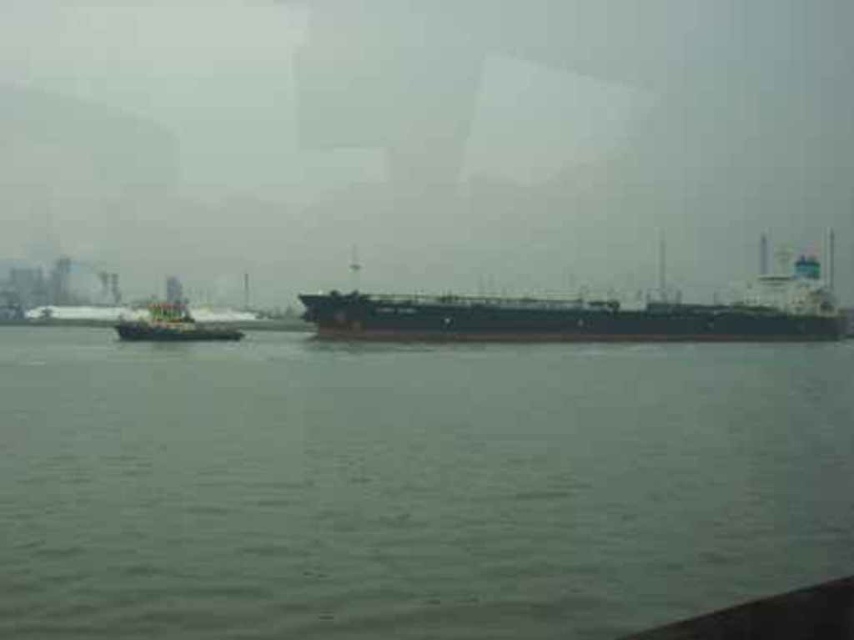
Question: Observing the image, what is the correct spatial positioning of gray matte water at center in reference to black matte cargo ship at center?

Choices:
 (A) above
 (B) below

Answer: (B)

Question: Does gray matte water at center appear on the left side of green matte tugboat at left?

Choices:
 (A) yes
 (B) no

Answer: (B)

Question: Which of the following is the farthest from the observer?

Choices:
 (A) gray matte water at center
 (B) black matte cargo ship at center

Answer: (B)

Question: Which point appears farthest from the camera in this image?

Choices:
 (A) (557, 340)
 (B) (802, 566)
 (C) (177, 301)

Answer: (C)

Question: Which of the following is the farthest from the observer?

Choices:
 (A) green matte tugboat at left
 (B) black matte cargo ship at center
 (C) gray matte water at center

Answer: (A)

Question: In this image, where is gray matte water at center located relative to black matte cargo ship at center?

Choices:
 (A) above
 (B) below

Answer: (B)